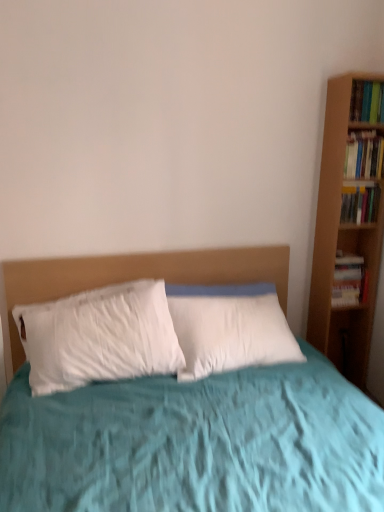
Question: Is hardcover book at right, the third book ordered from the bottom, further to camera compared to hardcover book at upper right, marked as the first book in a top-to-bottom arrangement?

Choices:
 (A) yes
 (B) no

Answer: (A)

Question: Is hardcover book at right, the third book ordered from the bottom, facing towards hardcover book at upper right, marked as the first book in a top-to-bottom arrangement?

Choices:
 (A) yes
 (B) no

Answer: (B)

Question: Is hardcover book at right, arranged as the 2th book when viewed from the top, not near hardcover book at upper right, placed as the fourth book when sorted from bottom to top?

Choices:
 (A) yes
 (B) no

Answer: (B)

Question: Are hardcover book at right, the third book ordered from the bottom, and hardcover book at upper right, placed as the fourth book when sorted from bottom to top, making contact?

Choices:
 (A) yes
 (B) no

Answer: (B)

Question: Is hardcover book at right, the third book ordered from the bottom, oriented away from hardcover book at upper right, marked as the first book in a top-to-bottom arrangement?

Choices:
 (A) yes
 (B) no

Answer: (B)

Question: From the image's perspective, is hardcover book at right, which is the 3th book in top-to-bottom order, located above or below hardcover book at upper right, marked as the first book in a top-to-bottom arrangement?

Choices:
 (A) above
 (B) below

Answer: (B)

Question: In terms of width, does hardcover book at right, which is the 3th book in top-to-bottom order, look wider or thinner when compared to hardcover book at upper right, marked as the first book in a top-to-bottom arrangement?

Choices:
 (A) thin
 (B) wide

Answer: (A)

Question: Based on their sizes in the image, would you say hardcover book at right, which is the 3th book in top-to-bottom order, is bigger or smaller than hardcover book at upper right, placed as the fourth book when sorted from bottom to top?

Choices:
 (A) big
 (B) small

Answer: (B)

Question: Is hardcover book at right, which is the second book in bottom-to-top order, inside or outside of hardcover book at upper right, placed as the fourth book when sorted from bottom to top?

Choices:
 (A) inside
 (B) outside

Answer: (B)

Question: In the image, is hardcover book at right, arranged as the 2th book when viewed from the top, on the left side or the right side of hardcover book at upper right, marked as the first book in a top-to-bottom arrangement?

Choices:
 (A) right
 (B) left

Answer: (B)

Question: Is point (377, 177) positioned closer to the camera than point (362, 117)?

Choices:
 (A) closer
 (B) farther

Answer: (B)

Question: From the image's perspective, is hardcover book at right, arranged as the 2th book when viewed from the top, positioned above or below hardcover book at upper right, placed as the fourth book when sorted from bottom to top?

Choices:
 (A) below
 (B) above

Answer: (A)

Question: Considering the positions of hardcover book at right, the third book ordered from the bottom, and hardcover book at upper right, marked as the first book in a top-to-bottom arrangement, in the image, is hardcover book at right, the third book ordered from the bottom, bigger or smaller than hardcover book at upper right, marked as the first book in a top-to-bottom arrangement,?

Choices:
 (A) small
 (B) big

Answer: (B)

Question: Considering the positions of hardcover book at upper right, placed as the fourth book when sorted from bottom to top, and hardcover book at right, which is the 3th book in top-to-bottom order, in the image, is hardcover book at upper right, placed as the fourth book when sorted from bottom to top, taller or shorter than hardcover book at right, which is the 3th book in top-to-bottom order,?

Choices:
 (A) tall
 (B) short

Answer: (A)

Question: Considering the relative positions of hardcover book at upper right, marked as the first book in a top-to-bottom arrangement, and hardcover book at right, which is the second book in bottom-to-top order, in the image provided, is hardcover book at upper right, marked as the first book in a top-to-bottom arrangement, to the left or to the right of hardcover book at right, which is the second book in bottom-to-top order,?

Choices:
 (A) left
 (B) right

Answer: (B)